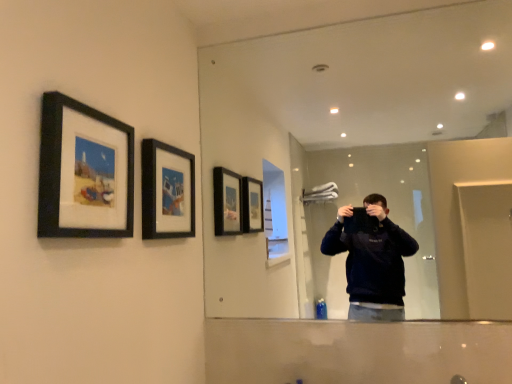
Question: From the image's perspective, is black matte picture frame at upper left, which is the first picture frame from left to right, located beneath black matte picture frame at upper center, which ranks as the 2th picture frame in left-to-right order?

Choices:
 (A) no
 (B) yes

Answer: (A)

Question: Is black matte picture frame at upper center, which ranks as the 2th picture frame in left-to-right order, at the back of black matte picture frame at upper left, arranged as the second picture frame when viewed from the right?

Choices:
 (A) yes
 (B) no

Answer: (B)

Question: Is black matte picture frame at upper left, which is counted as the 1th picture frame, starting from the front, outside of black matte picture frame at upper center, which ranks as the 2th picture frame in left-to-right order?

Choices:
 (A) no
 (B) yes

Answer: (B)

Question: Can you confirm if black matte picture frame at upper left, arranged as the second picture frame when viewed from the right, is bigger than black matte picture frame at upper center, the first picture frame positioned from the back?

Choices:
 (A) yes
 (B) no

Answer: (A)

Question: Is black matte picture frame at upper left, which is the first picture frame from left to right, further to camera compared to black matte picture frame at upper center, which ranks as the 2th picture frame in left-to-right order?

Choices:
 (A) yes
 (B) no

Answer: (B)

Question: Does black matte picture frame at upper left, arranged as the second picture frame when viewed from the right, have a lesser width compared to black matte picture frame at upper center, which ranks as the 2th picture frame in left-to-right order?

Choices:
 (A) yes
 (B) no

Answer: (B)

Question: Does clear glass mirror at upper center turn towards black matte picture frame at upper left, which appears as the 2th picture frame when viewed from the back?

Choices:
 (A) no
 (B) yes

Answer: (B)

Question: Does clear glass mirror at upper center have a lesser width compared to black matte picture frame at upper left, arranged as the second picture frame when viewed from the right?

Choices:
 (A) yes
 (B) no

Answer: (A)

Question: Is clear glass mirror at upper center positioned with its back to black matte picture frame at upper left, arranged as the second picture frame when viewed from the right?

Choices:
 (A) yes
 (B) no

Answer: (B)

Question: From the image's perspective, is clear glass mirror at upper center over black matte picture frame at upper left, which is the first picture frame from left to right?

Choices:
 (A) no
 (B) yes

Answer: (B)

Question: Is clear glass mirror at upper center wider than black matte picture frame at upper left, which appears as the 2th picture frame when viewed from the back?

Choices:
 (A) no
 (B) yes

Answer: (A)

Question: From a real-world perspective, does clear glass mirror at upper center sit lower than black matte picture frame at upper left, arranged as the second picture frame when viewed from the right?

Choices:
 (A) yes
 (B) no

Answer: (B)

Question: From a real-world perspective, does clear glass mirror at upper center stand above black matte picture frame at upper center, the first picture frame positioned from the back?

Choices:
 (A) no
 (B) yes

Answer: (B)